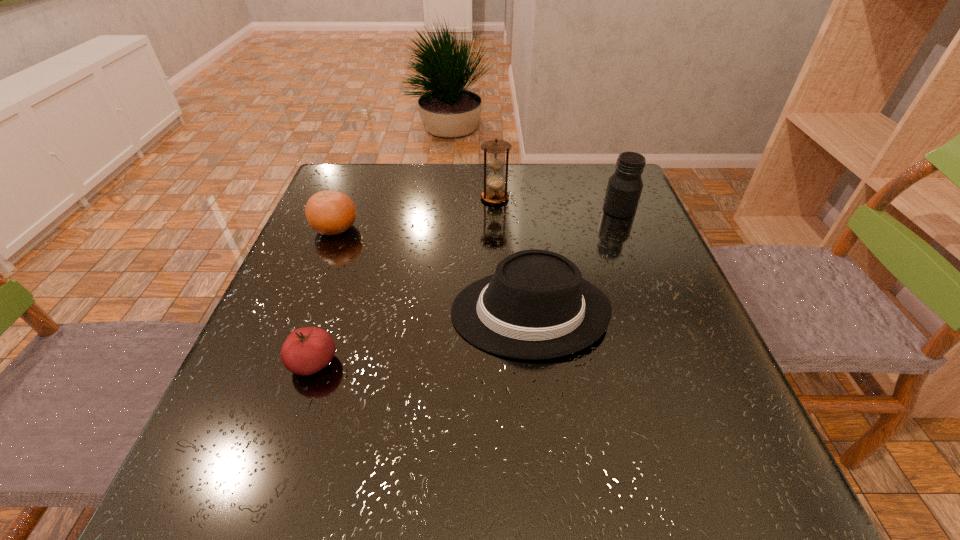
Image resolution: width=960 pixels, height=540 pixels. What are the coordinates of `vacant space that is in between the clementine and the fedora` in the screenshot? It's located at (432, 271).

This screenshot has height=540, width=960. Identify the location of free space between the tomato and the clementine. (324, 296).

Where is `vacant region between the clementine and the tomato`? Image resolution: width=960 pixels, height=540 pixels. vacant region between the clementine and the tomato is located at coordinates (324, 296).

Select which object is the third closest to the clementine. Please provide its 2D coordinates. Your answer should be formatted as a tuple, i.e. [(x, y)], where the tuple contains the x and y coordinates of a point satisfying the conditions above.

[(495, 181)]

The height and width of the screenshot is (540, 960). I want to click on the fourth closest object relative to the third tallest object, so click(x=328, y=212).

This screenshot has height=540, width=960. In order to click on free space that satisfies the following two spatial constraints: 1. on the front side of the jar; 2. on the right side of the hourglass in this screenshot , I will do `click(495, 209)`.